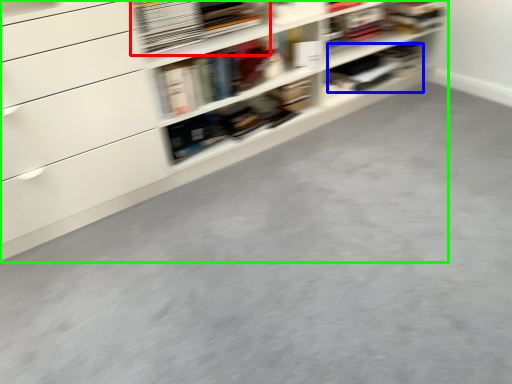
Question: Based on their relative distances, which object is farther from book (highlighted by a red box)? Choose from book (highlighted by a blue box) and shelf (highlighted by a green box).

Choices:
 (A) book
 (B) shelf

Answer: (A)